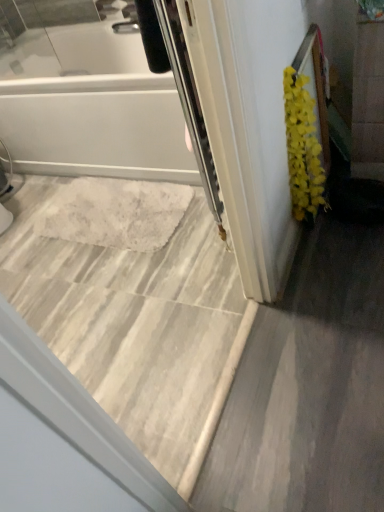
Locate an element on the screen. The width and height of the screenshot is (384, 512). yellow fluffy plant at right is located at coordinates (303, 149).

This screenshot has width=384, height=512. Find the location of `marble tile floor at center`. marble tile floor at center is located at coordinates (133, 305).

Measure the distance between white glossy bathtub at upper left and camera.

white glossy bathtub at upper left and camera are 1.66 meters apart.

Image resolution: width=384 pixels, height=512 pixels. Find the location of `yellow fluffy plant at right`. yellow fluffy plant at right is located at coordinates (303, 149).

From a real-world perspective, who is located lower, yellow fluffy plant at right or white glossy bathtub at upper left?

yellow fluffy plant at right.

At what (x,y) coordinates should I click in order to perform the action: click on flower beneath the white glossy bathtub at upper left (from a real-world perspective). Please return your answer as a coordinate pair (x, y). Looking at the image, I should click on click(x=303, y=149).

Which object is closer to the camera taking this photo, yellow fluffy plant at right or white glossy bathtub at upper left?

white glossy bathtub at upper left is closer to the camera.

Is white glossy bathtub at upper left surrounded by yellow fluffy plant at right?

No, white glossy bathtub at upper left is not inside yellow fluffy plant at right.

From the image's perspective, which one is positioned higher, white glossy bathtub at upper left or yellow fluffy plant at right?

white glossy bathtub at upper left.

Is yellow fluffy plant at right at the back of white glossy bathtub at upper left?

No, white glossy bathtub at upper left is not facing away from yellow fluffy plant at right.

Looking at this image, from a real-world perspective, is white glossy bathtub at upper left positioned under yellow fluffy plant at right based on gravity?

No.

Which is more to the right, white glossy bathtub at upper left or yellow fluffy plant at right?

From the viewer's perspective, yellow fluffy plant at right appears more on the right side.

Which of these two, yellow fluffy plant at right or marble tile floor at center, stands taller?

With more height is yellow fluffy plant at right.

Who is more distant, yellow fluffy plant at right or marble tile floor at center?

A: Positioned behind is yellow fluffy plant at right.

Is yellow fluffy plant at right to the left or to the right of marble tile floor at center in the image?

Based on their positions, yellow fluffy plant at right is located to the right of marble tile floor at center.

Is yellow fluffy plant at right aimed at marble tile floor at center?

No, yellow fluffy plant at right does not turn towards marble tile floor at center.

From the image's perspective, which is below, marble tile floor at center or white glossy bathtub at upper left?

From the image's view, marble tile floor at center is below.

Considering the relative positions of marble tile floor at center and white glossy bathtub at upper left in the image provided, is marble tile floor at center to the left or to the right of white glossy bathtub at upper left?

marble tile floor at center is positioned on white glossy bathtub at upper left's left side.

Considering the relative sizes of marble tile floor at center and white glossy bathtub at upper left in the image provided, is marble tile floor at center smaller than white glossy bathtub at upper left?

Incorrect, marble tile floor at center is not smaller in size than white glossy bathtub at upper left.

The width and height of the screenshot is (384, 512). Identify the location of stairwell located underneath the white glossy bathtub at upper left (from a real-world perspective). (133, 305).

Considering the sizes of objects marble tile floor at center and yellow fluffy plant at right in the image provided, who is shorter, marble tile floor at center or yellow fluffy plant at right?

With less height is marble tile floor at center.

Where is `flower above the marble tile floor at center (from a real-world perspective)`? Image resolution: width=384 pixels, height=512 pixels. flower above the marble tile floor at center (from a real-world perspective) is located at coordinates (303, 149).

Which point is more distant from viewer, (182, 309) or (304, 146)?

The point (182, 309) is farther from the camera.

Is white glossy bathtub at upper left smaller than marble tile floor at center?

Yes.

Is marble tile floor at center at the back of white glossy bathtub at upper left?

That's not correct — white glossy bathtub at upper left is not looking away from marble tile floor at center.

In the scene shown: Between white glossy bathtub at upper left and marble tile floor at center, which one appears on the left side from the viewer's perspective?

marble tile floor at center.

This screenshot has width=384, height=512. I want to click on stairwell located on the left of white glossy bathtub at upper left, so click(x=133, y=305).

What are the coordinates of `bathtub that is above the yellow fluffy plant at right (from a real-world perspective)` in the screenshot? It's located at (91, 105).

The image size is (384, 512). Identify the location of flower below the white glossy bathtub at upper left (from the image's perspective). (303, 149).

From the image, which object appears to be farther from marble tile floor at center, white glossy bathtub at upper left or yellow fluffy plant at right?

yellow fluffy plant at right lies further to marble tile floor at center than the other object.

Which object lies nearer to the anchor point white glossy bathtub at upper left, yellow fluffy plant at right or marble tile floor at center?

Result: Based on the image, marble tile floor at center appears to be nearer to white glossy bathtub at upper left.

Based on their spatial positions, is white glossy bathtub at upper left or marble tile floor at center closer to yellow fluffy plant at right?

Among the two, marble tile floor at center is located nearer to yellow fluffy plant at right.

Based on their spatial positions, is marble tile floor at center or white glossy bathtub at upper left further from yellow fluffy plant at right?

white glossy bathtub at upper left is positioned further to the anchor yellow fluffy plant at right.

When comparing their distances from white glossy bathtub at upper left, does marble tile floor at center or yellow fluffy plant at right seem closer?

Based on the image, marble tile floor at center appears to be nearer to white glossy bathtub at upper left.

When comparing their distances from marble tile floor at center, does yellow fluffy plant at right or white glossy bathtub at upper left seem closer?

white glossy bathtub at upper left is closer to marble tile floor at center.

Image resolution: width=384 pixels, height=512 pixels. I want to click on bathtub between marble tile floor at center and yellow fluffy plant at right in the horizontal direction, so click(x=91, y=105).